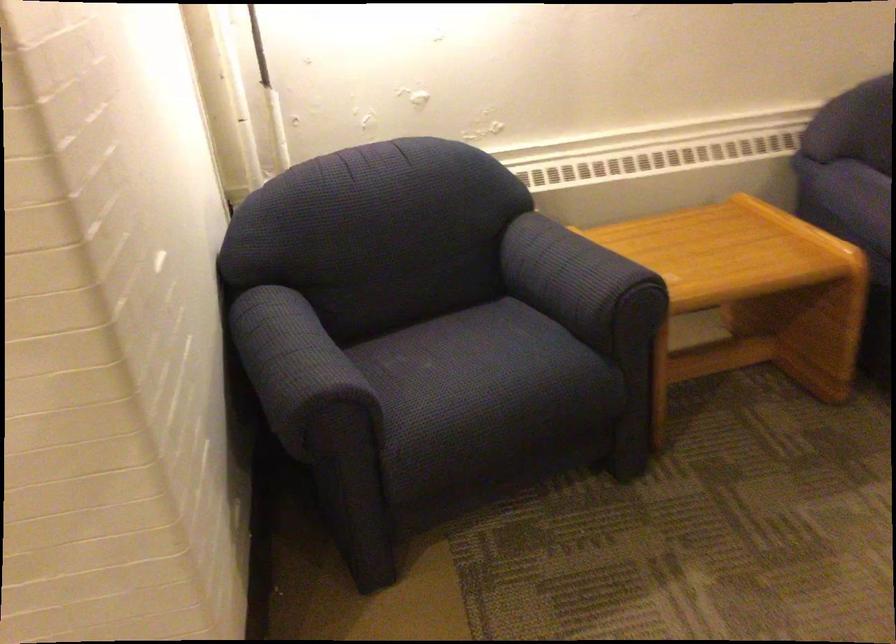
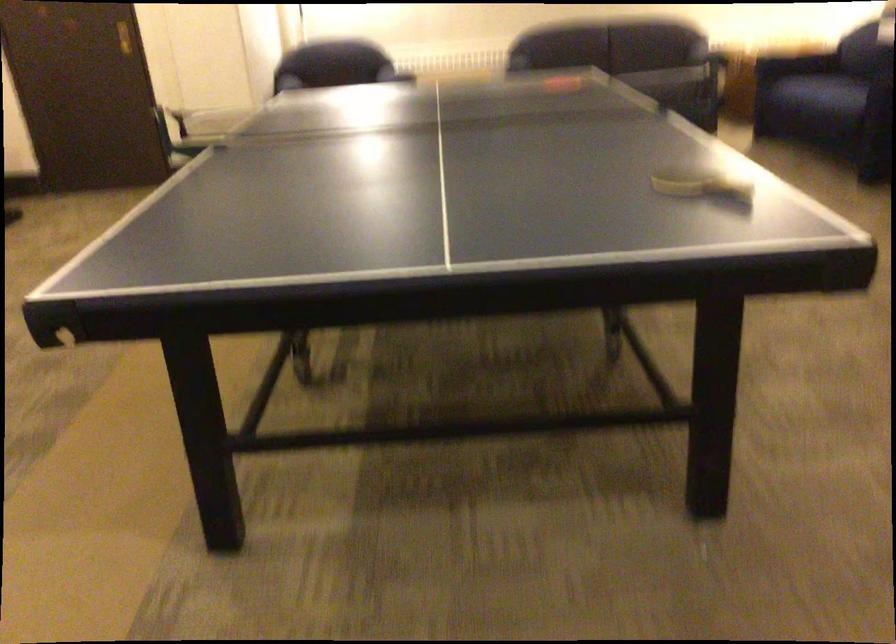
Question: I am providing you with two images of the same scene from different viewpoints. After the viewpoint changes to image2, which objects are now occluded?

Choices:
 (A) sofa sitting surface
 (B) red appliance dial
 (C) blue chair armrest
 (D) chair sitting surface

Answer: (C)